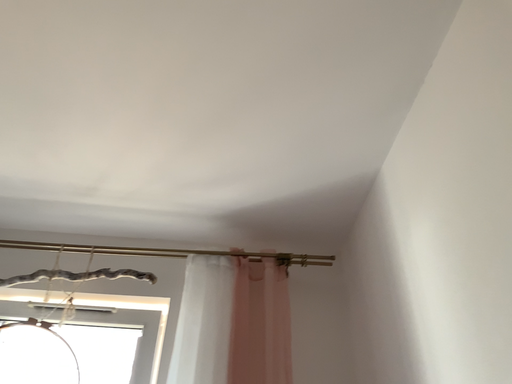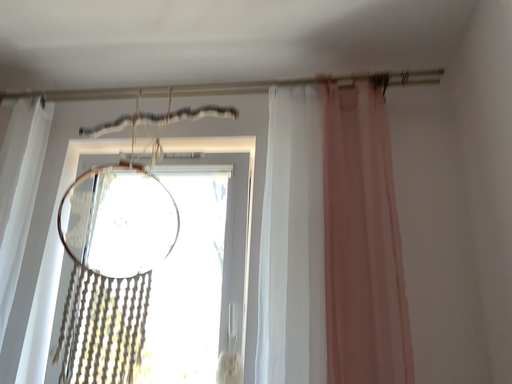
Question: Which way did the camera rotate in the video?

Choices:
 (A) rotated right
 (B) rotated left

Answer: (B)